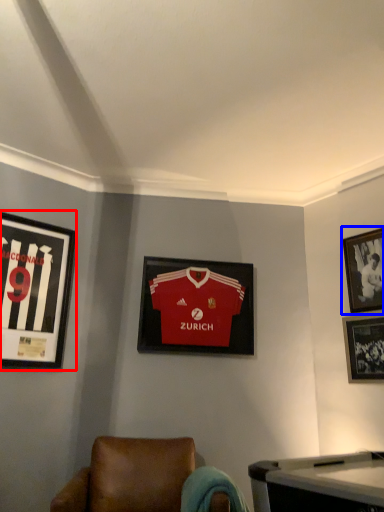
Question: Which object appears farthest to the camera in this image, picture frame (highlighted by a red box) or picture frame (highlighted by a blue box)?

Choices:
 (A) picture frame
 (B) picture frame

Answer: (B)